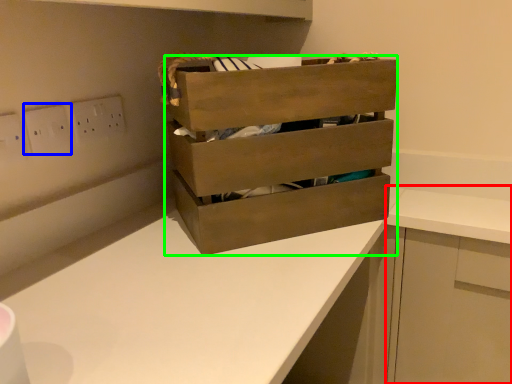
Question: Estimate the real-world distances between objects in this image. Which object is farther from cabinetry (highlighted by a red box), electric outlet (highlighted by a blue box) or chest of drawers (highlighted by a green box)?

Choices:
 (A) electric outlet
 (B) chest of drawers

Answer: (A)